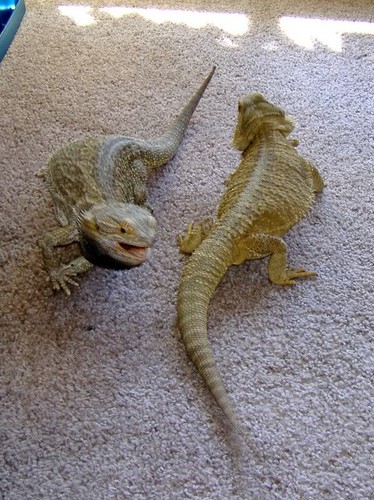
At what (x,y) coordinates should I click in order to perform the action: click on carpet. Please return your answer as a coordinate pair (x, y). This screenshot has width=374, height=500. Looking at the image, I should click on (336, 418).